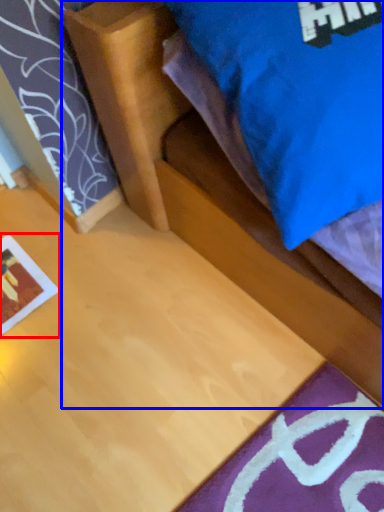
Question: Which point is further to the camera, print (highlighted by a red box) or bed (highlighted by a blue box)?

Choices:
 (A) print
 (B) bed

Answer: (A)